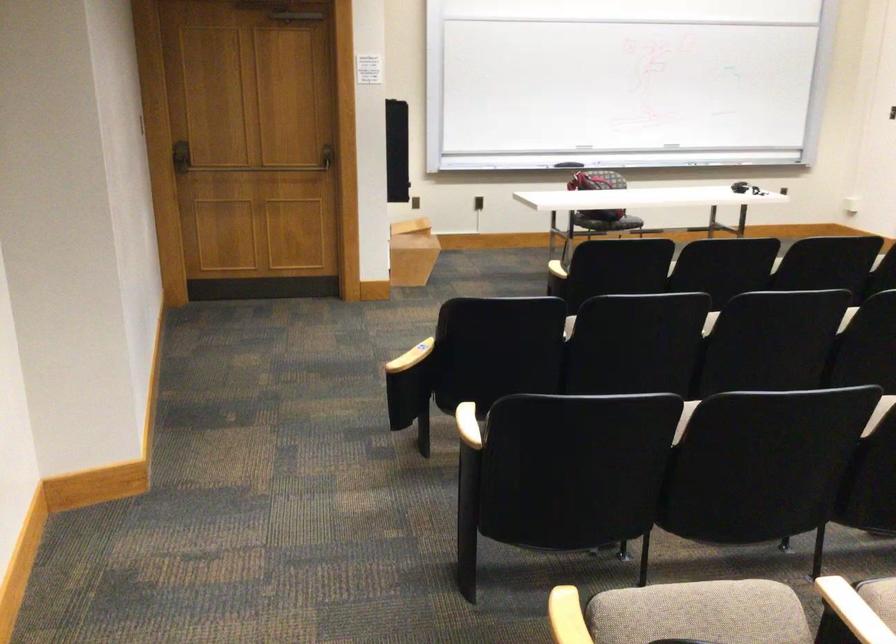
What are the coordinates of `door push bar` in the screenshot? It's located at (297, 13).